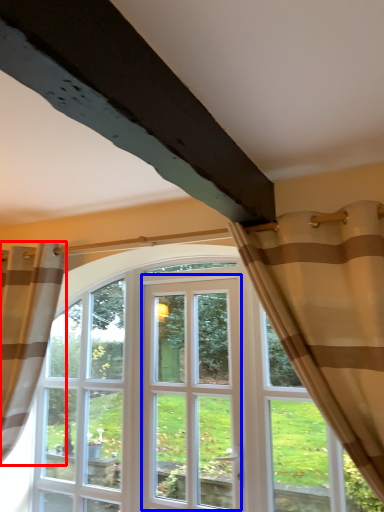
Question: Which object appears farthest to the camera in this image, curtain (highlighted by a red box) or screen door (highlighted by a blue box)?

Choices:
 (A) curtain
 (B) screen door

Answer: (B)